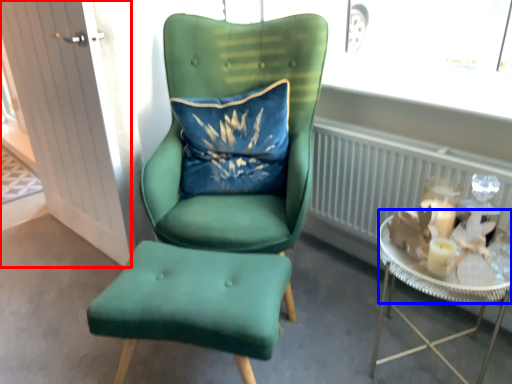
Question: Which of the following is the closest to the observer, glass door (highlighted by a red box) or glass table (highlighted by a blue box)?

Choices:
 (A) glass door
 (B) glass table

Answer: (B)